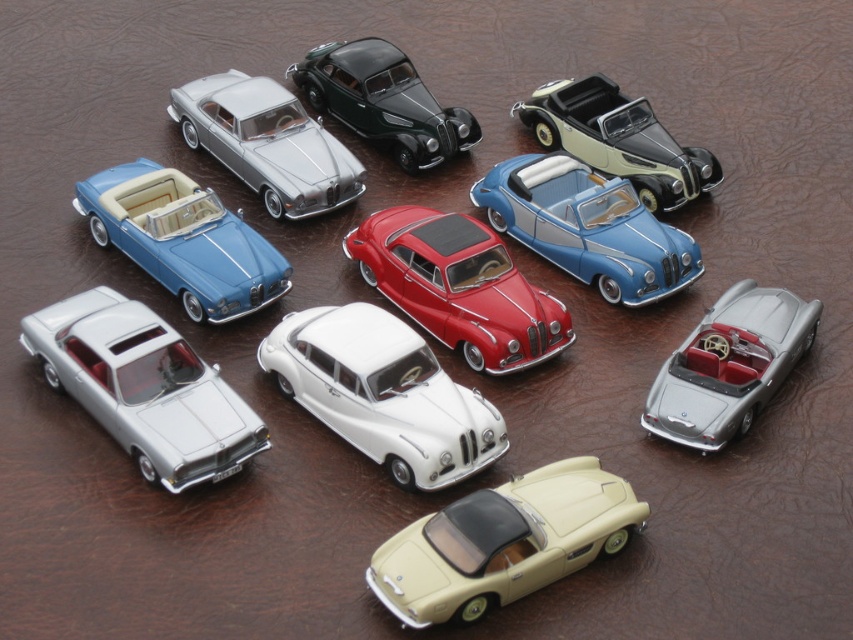
Question: Is white glossy sedan at center closer to camera compared to shiny red car at center?

Choices:
 (A) no
 (B) yes

Answer: (B)

Question: Based on their relative distances, which object is nearer to the white glossy sedan at center?

Choices:
 (A) metallic silver convertible at center right
 (B) matte black convertible at upper right
 (C) matte silver car at upper left

Answer: (A)

Question: Among these points, which one is nearest to the camera?

Choices:
 (A) (207, 262)
 (B) (306, 324)
 (C) (689, 282)
 (D) (762, 296)

Answer: (B)

Question: Is white glossy sedan at center closer to the viewer compared to matte silver car at upper left?

Choices:
 (A) no
 (B) yes

Answer: (B)

Question: Does blue metallic convertible at center appear over shiny black car at upper center?

Choices:
 (A) no
 (B) yes

Answer: (A)

Question: Based on their relative distances, which object is nearer to the silver metallic car at lower left?

Choices:
 (A) white glossy sedan at center
 (B) matte black convertible at upper right

Answer: (A)